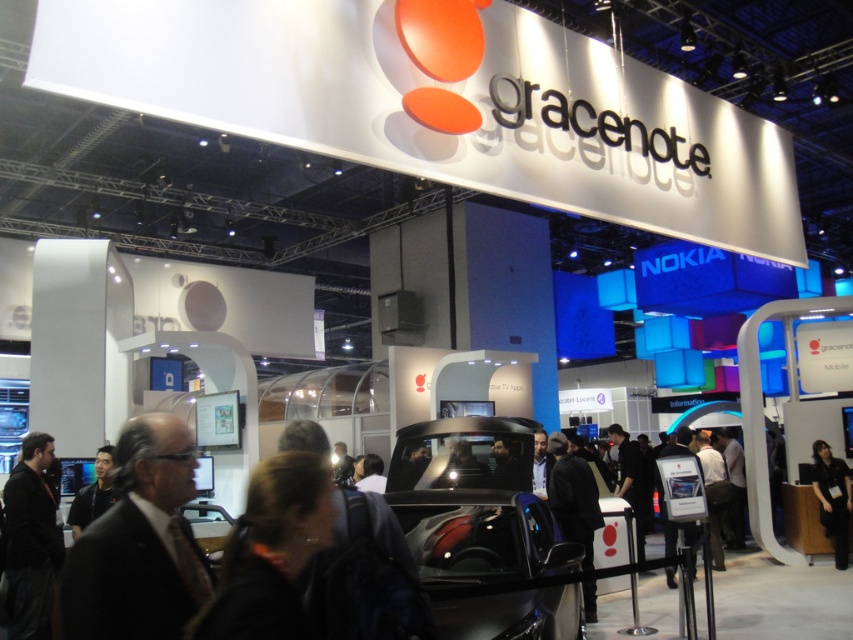
How distant is black suit at lower left from black fabric shirt at lower right?

10.48 meters

Does black suit at lower left have a greater width compared to black fabric shirt at lower right?

Incorrect, black suit at lower left's width does not surpass black fabric shirt at lower right's.

You are a GUI agent. You are given a task and a screenshot of the screen. Output one action in this format:
    pyautogui.click(x=<x>, y=<y>)
    Task: Click on the black suit at lower left
    This screenshot has height=640, width=853.
    Given the screenshot: What is the action you would take?
    pyautogui.click(x=138, y=544)

Between black suit at lower left and black fabric jacket at lower left, which one is positioned lower?

black fabric jacket at lower left is lower down.

Is black suit at lower left further to camera compared to black fabric jacket at lower left?

No, it is not.

Where is `black suit at lower left`? The width and height of the screenshot is (853, 640). black suit at lower left is located at coordinates (138, 544).

Find the location of a particular element. The image size is (853, 640). black suit at lower left is located at coordinates (138, 544).

Does black fabric jacket at lower left have a greater height compared to black fabric shirt at lower right?

Incorrect, black fabric jacket at lower left's height is not larger of black fabric shirt at lower right's.

Is point (28, 566) behind point (840, 544)?

No, (28, 566) is in front of (840, 544).

The image size is (853, 640). I want to click on black fabric jacket at lower left, so click(30, 540).